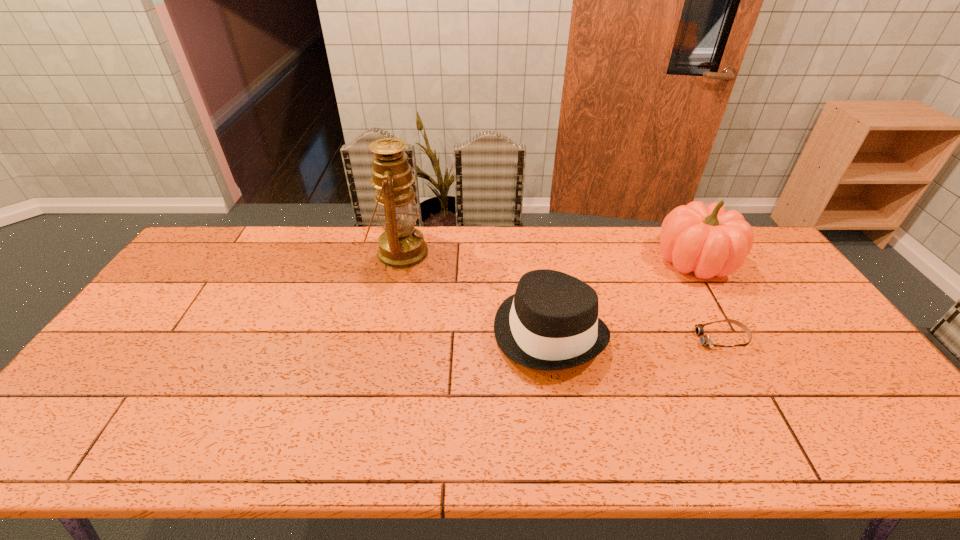
At what (x,y) coordinates should I click in order to perform the action: click on vacant space that's between the second object from left to right and the oil lamp. Please return your answer as a coordinate pair (x, y). The height and width of the screenshot is (540, 960). Looking at the image, I should click on (475, 293).

Identify the location of vacant space that is in between the goggles and the third object from right to left. This screenshot has width=960, height=540. (636, 336).

Where is `unoccupied area between the second shortest object and the goggles`? This screenshot has height=540, width=960. unoccupied area between the second shortest object and the goggles is located at coordinates (636, 336).

This screenshot has height=540, width=960. Find the location of `vacant point located between the second shortest object and the tallest object`. vacant point located between the second shortest object and the tallest object is located at coordinates (475, 293).

Identify the location of blank region between the third shortest object and the fedora. (622, 297).

Locate an element on the screen. The height and width of the screenshot is (540, 960). vacant space that is in between the second tallest object and the leftmost object is located at coordinates (547, 257).

Where is `vacant area that lies between the second shortest object and the leftmost object`? Image resolution: width=960 pixels, height=540 pixels. vacant area that lies between the second shortest object and the leftmost object is located at coordinates (475, 293).

The image size is (960, 540). I want to click on free space between the fedora and the second tallest object, so click(x=622, y=297).

Locate which object ranks third in proximity to the tallest object. Please provide its 2D coordinates. Your answer should be formatted as a tuple, i.e. [(x, y)], where the tuple contains the x and y coordinates of a point satisfying the conditions above.

[(705, 340)]

Point out which object is positioned as the third nearest to the third object from right to left. Please provide its 2D coordinates. Your answer should be formatted as a tuple, i.e. [(x, y)], where the tuple contains the x and y coordinates of a point satisfying the conditions above.

[(705, 340)]